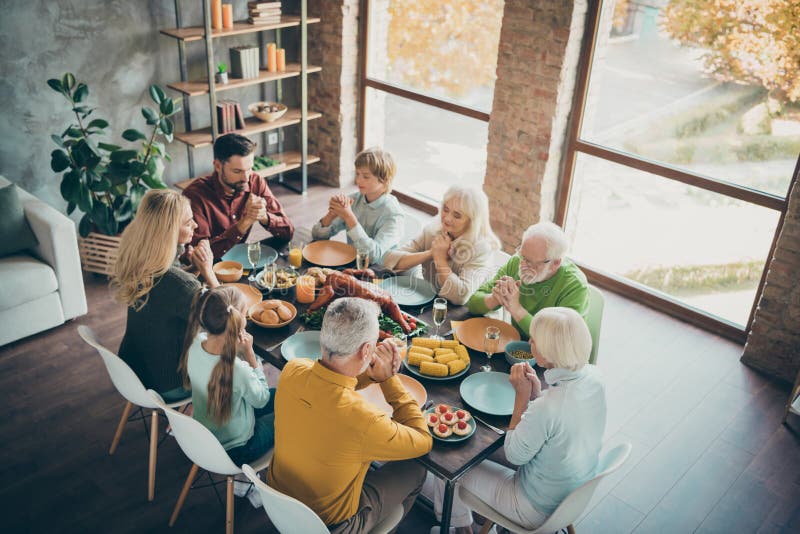
This screenshot has width=800, height=534. I want to click on dishes with food on them, so click(278, 310), click(434, 354), click(333, 286), click(442, 420), click(286, 285), click(221, 265), click(520, 350).